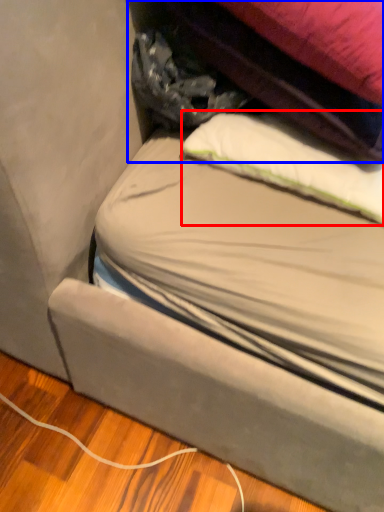
Question: Which object is further to the camera taking this photo, pillow (highlighted by a red box) or bag (highlighted by a blue box)?

Choices:
 (A) pillow
 (B) bag

Answer: (A)